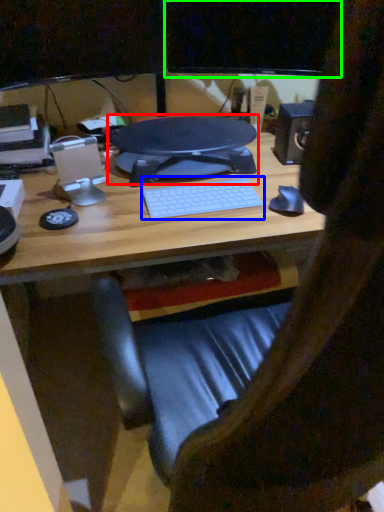
Question: Considering the real-world distances, which object is farthest from desktop (highlighted by a red box)? computer keyboard (highlighted by a blue box) or computer monitor (highlighted by a green box)?

Choices:
 (A) computer keyboard
 (B) computer monitor

Answer: (B)